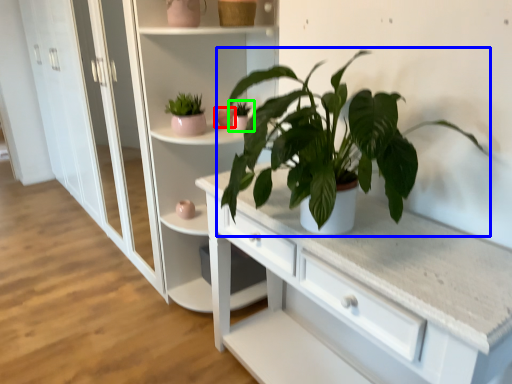
Question: Estimate the real-world distances between objects in this image. Which object is closer to flowerpot (highlighted by a red box), houseplant (highlighted by a blue box) or houseplant (highlighted by a green box)?

Choices:
 (A) houseplant
 (B) houseplant

Answer: (B)